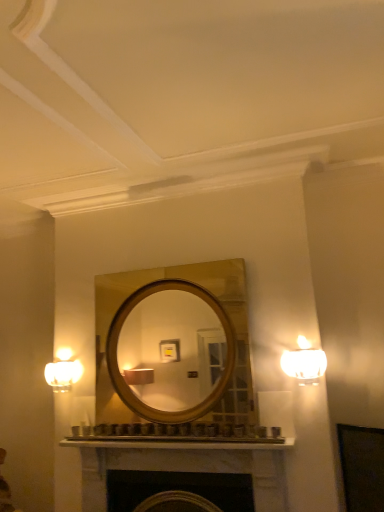
Question: Is white frosted glass lamp at right a part of matte white sconce at left?

Choices:
 (A) no
 (B) yes

Answer: (A)

Question: Can you confirm if matte white sconce at left is wider than white frosted glass lamp at right?

Choices:
 (A) yes
 (B) no

Answer: (B)

Question: Is matte white sconce at left looking in the opposite direction of white frosted glass lamp at right?

Choices:
 (A) no
 (B) yes

Answer: (A)

Question: Is the position of matte white sconce at left less distant than that of white frosted glass lamp at right?

Choices:
 (A) no
 (B) yes

Answer: (A)

Question: Is matte white sconce at left not inside white frosted glass lamp at right?

Choices:
 (A) no
 (B) yes

Answer: (B)

Question: Is white marble fireplace at lower center bigger or smaller than white frosted glass lamp at right?

Choices:
 (A) small
 (B) big

Answer: (B)

Question: Visually, is white marble fireplace at lower center positioned to the left or to the right of white frosted glass lamp at right?

Choices:
 (A) right
 (B) left

Answer: (B)

Question: Is white marble fireplace at lower center in front of or behind white frosted glass lamp at right in the image?

Choices:
 (A) front
 (B) behind

Answer: (A)

Question: Considering the positions of point (97, 487) and point (306, 362), is point (97, 487) closer or farther from the camera than point (306, 362)?

Choices:
 (A) closer
 (B) farther

Answer: (B)

Question: Is point (223, 464) positioned closer to the camera than point (59, 364)?

Choices:
 (A) farther
 (B) closer

Answer: (B)

Question: Considering the positions of white marble fireplace at lower center and matte white sconce at left in the image, is white marble fireplace at lower center bigger or smaller than matte white sconce at left?

Choices:
 (A) big
 (B) small

Answer: (A)

Question: Is white marble fireplace at lower center spatially inside matte white sconce at left, or outside of it?

Choices:
 (A) outside
 (B) inside

Answer: (A)

Question: From a real-world perspective, relative to matte white sconce at left, is white marble fireplace at lower center vertically above or below?

Choices:
 (A) below
 (B) above

Answer: (A)

Question: Considering the positions of matte white sconce at left and white frosted glass lamp at right in the image, is matte white sconce at left taller or shorter than white frosted glass lamp at right?

Choices:
 (A) tall
 (B) short

Answer: (B)

Question: Is matte white sconce at left inside or outside of white frosted glass lamp at right?

Choices:
 (A) inside
 (B) outside

Answer: (B)